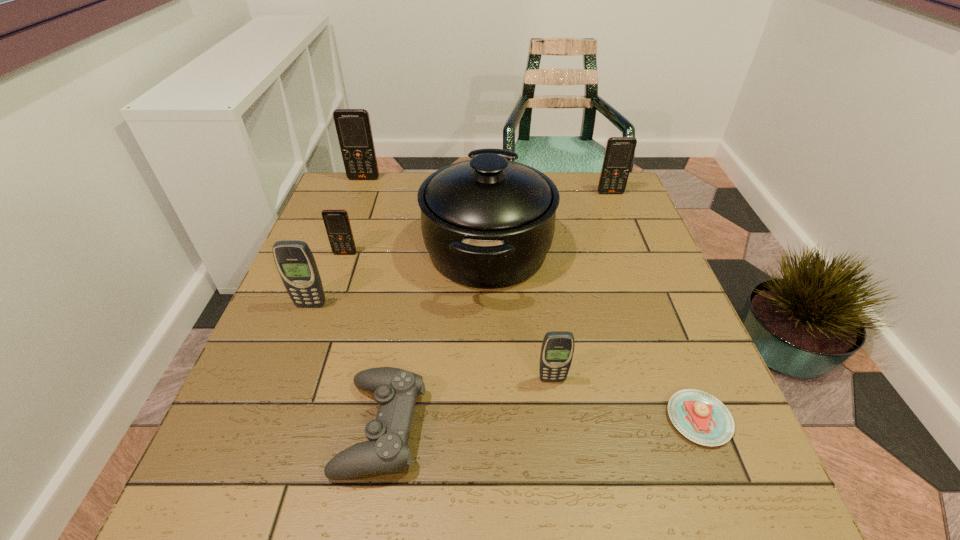
Image resolution: width=960 pixels, height=540 pixels. In order to click on the nearest cellular telephone in this screenshot , I will do `click(557, 349)`.

Where is `gray control`? The image size is (960, 540). gray control is located at coordinates (395, 390).

Locate an element on the screen. The height and width of the screenshot is (540, 960). the second shortest object is located at coordinates tap(395, 390).

The image size is (960, 540). Identify the location of the shortest object. (702, 418).

The width and height of the screenshot is (960, 540). Find the location of `vacant space located on the right of the black saucepan`. vacant space located on the right of the black saucepan is located at coordinates pyautogui.click(x=606, y=249).

Identify the location of free space located 0.390m on the screen of the farthest object. (333, 262).

Locate an element on the screen. vacant space located 0.200m on the screen of the farther gray cellular telephone is located at coordinates (280, 384).

The image size is (960, 540). What are the coordinates of `free space located on the screen of the rightmost orange cellular telephone` in the screenshot? It's located at (620, 218).

Identify the location of free spot located 0.160m on the screen of the smallest orange cellular telephone. (329, 301).

Image resolution: width=960 pixels, height=540 pixels. Find the location of `vacant space situated on the screen of the fourth cellular telephone from left to right`. vacant space situated on the screen of the fourth cellular telephone from left to right is located at coordinates (560, 436).